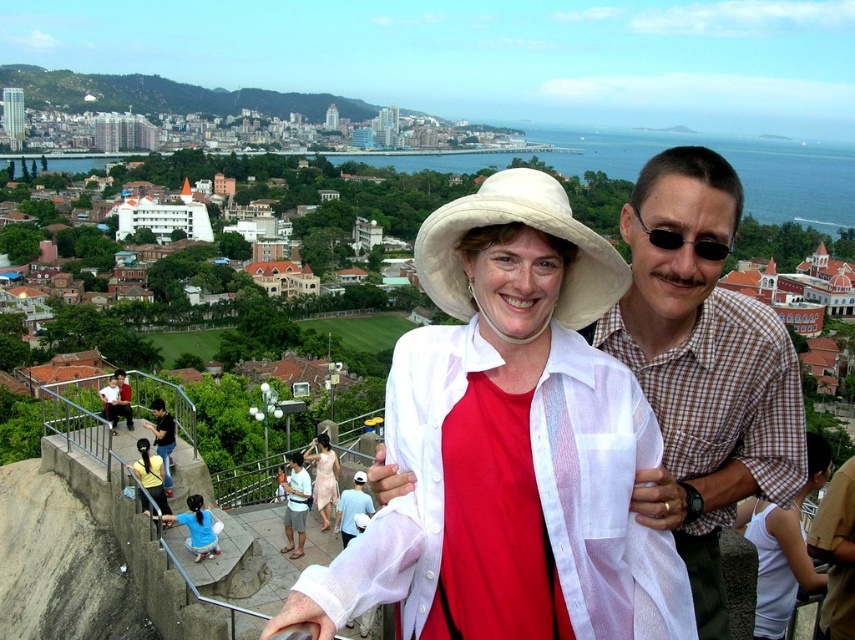
Is white sheer blouse at center thinner than yellow fabric shirt at lower left?

In fact, white sheer blouse at center might be wider than yellow fabric shirt at lower left.

Who is positioned more to the left, white sheer blouse at center or yellow fabric shirt at lower left?

From the viewer's perspective, yellow fabric shirt at lower left appears more on the left side.

Is point (547, 346) closer to camera compared to point (158, 492)?

Yes.

Where is `white sheer blouse at center`? The image size is (855, 640). white sheer blouse at center is located at coordinates (510, 445).

Is brown checkered shirt at center to the left of matte white blouse at center from the viewer's perspective?

In fact, brown checkered shirt at center is to the right of matte white blouse at center.

Who is shorter, brown checkered shirt at center or matte white blouse at center?

matte white blouse at center

The height and width of the screenshot is (640, 855). Describe the element at coordinates (702, 368) in the screenshot. I see `brown checkered shirt at center` at that location.

You are a GUI agent. You are given a task and a screenshot of the screen. Output one action in this format:
    pyautogui.click(x=<x>, y=<y>)
    Task: Click on the brown checkered shirt at center
    This screenshot has height=640, width=855.
    Given the screenshot: What is the action you would take?
    pyautogui.click(x=702, y=368)

Which is above, matte pink dress at center or black plastic sunglasses at upper right?

Answer: black plastic sunglasses at upper right is above.

Is matte pink dress at center above black plastic sunglasses at upper right?

No.

Between point (320, 516) and point (696, 253), which one is positioned behind?

Point (320, 516)

Locate an element on the screen. This screenshot has height=640, width=855. matte pink dress at center is located at coordinates [323, 476].